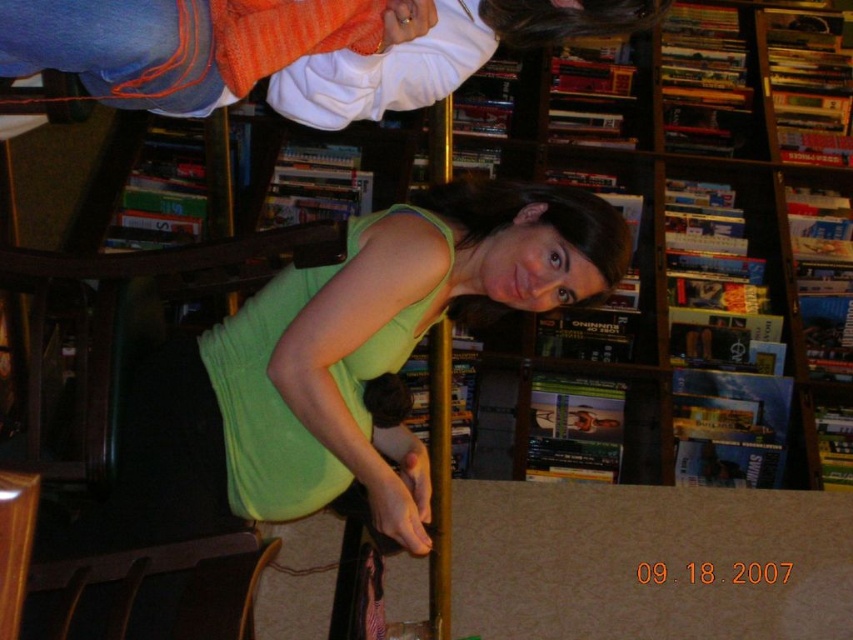
From the picture: Is wooden bookshelf at center to the right of green matte tank top at center from the viewer's perspective?

Yes, wooden bookshelf at center is to the right of green matte tank top at center.

Is wooden bookshelf at center thinner than green matte tank top at center?

Incorrect, wooden bookshelf at center's width is not less than green matte tank top at center's.

Between point (755, 465) and point (82, 13), which one is positioned in front?

Point (82, 13)

Locate an element on the screen. wooden bookshelf at center is located at coordinates (717, 250).